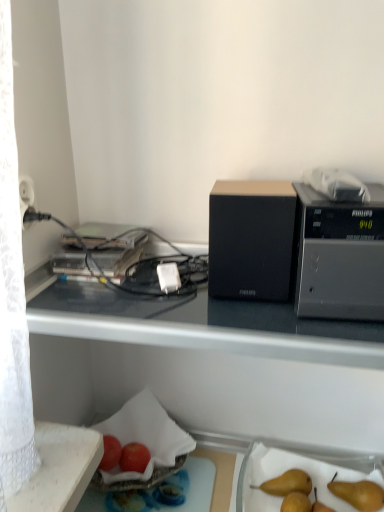
Question: From a real-world perspective, is white plastic power plug at center over black matte desk at upper center?

Choices:
 (A) no
 (B) yes

Answer: (B)

Question: From a real-world perspective, is white plastic power plug at center physically below black matte desk at upper center?

Choices:
 (A) yes
 (B) no

Answer: (B)

Question: Does white plastic power plug at center touch black matte desk at upper center?

Choices:
 (A) yes
 (B) no

Answer: (B)

Question: Can you confirm if white plastic power plug at center is smaller than black matte desk at upper center?

Choices:
 (A) no
 (B) yes

Answer: (B)

Question: Does white plastic power plug at center have a greater height compared to black matte desk at upper center?

Choices:
 (A) yes
 (B) no

Answer: (B)

Question: In terms of height, does red matte apple at lower center, placed as the 2th apple when sorted from left to right, look taller or shorter compared to white plastic power plug at center?

Choices:
 (A) tall
 (B) short

Answer: (B)

Question: From the image's perspective, is red matte apple at lower center, placed as the 2th apple when sorted from left to right, located above or below white plastic power plug at center?

Choices:
 (A) below
 (B) above

Answer: (A)

Question: Based on their sizes in the image, would you say red matte apple at lower center, which appears as the 1th apple when viewed from the right, is bigger or smaller than white plastic power plug at center?

Choices:
 (A) big
 (B) small

Answer: (A)

Question: Looking at their shapes, would you say red matte apple at lower center, placed as the 2th apple when sorted from left to right, is wider or thinner than white plastic power plug at center?

Choices:
 (A) wide
 (B) thin

Answer: (A)

Question: Considering the positions of black fabric speaker at center, which is the first appliance in left-to-right order, and white plastic power plug at center in the image, is black fabric speaker at center, which is the first appliance in left-to-right order, wider or thinner than white plastic power plug at center?

Choices:
 (A) wide
 (B) thin

Answer: (A)

Question: Relative to white plastic power plug at center, is black fabric speaker at center, which is the first appliance in left-to-right order, in front or behind?

Choices:
 (A) behind
 (B) front

Answer: (B)

Question: In terms of size, does black fabric speaker at center, which is the first appliance in left-to-right order, appear bigger or smaller than white plastic power plug at center?

Choices:
 (A) big
 (B) small

Answer: (A)

Question: From the image's perspective, is black fabric speaker at center, the 2th appliance viewed from the right, located above or below white plastic power plug at center?

Choices:
 (A) below
 (B) above

Answer: (B)

Question: Does point (279, 209) appear closer or farther from the camera than point (129, 459)?

Choices:
 (A) closer
 (B) farther

Answer: (A)

Question: From a real-world perspective, is black fabric speaker at center, which is the first appliance in left-to-right order, physically located above or below red matte apple at lower center, placed as the 2th apple when sorted from left to right?

Choices:
 (A) above
 (B) below

Answer: (A)